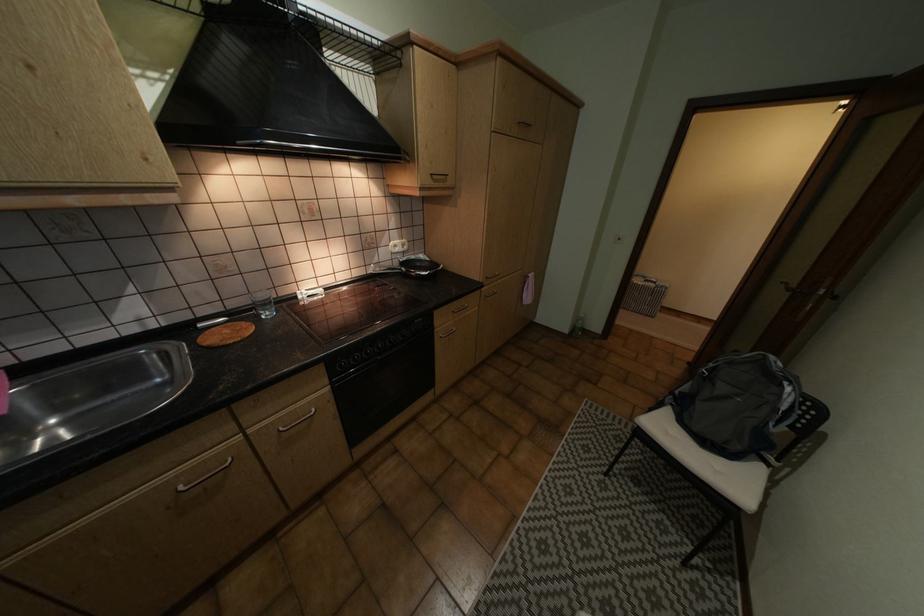
Describe the element at coordinates (262, 302) in the screenshot. I see `a clear glass cup` at that location.